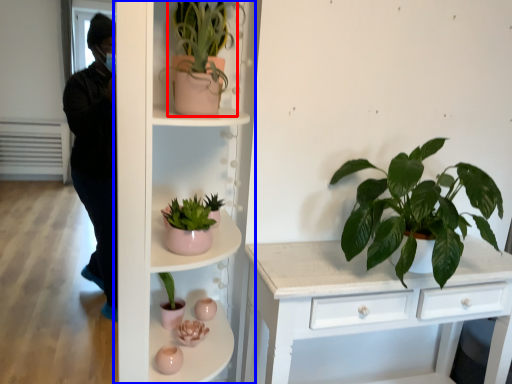
Question: Which object is further to the camera taking this photo, houseplant (highlighted by a red box) or shelf (highlighted by a blue box)?

Choices:
 (A) houseplant
 (B) shelf

Answer: (A)